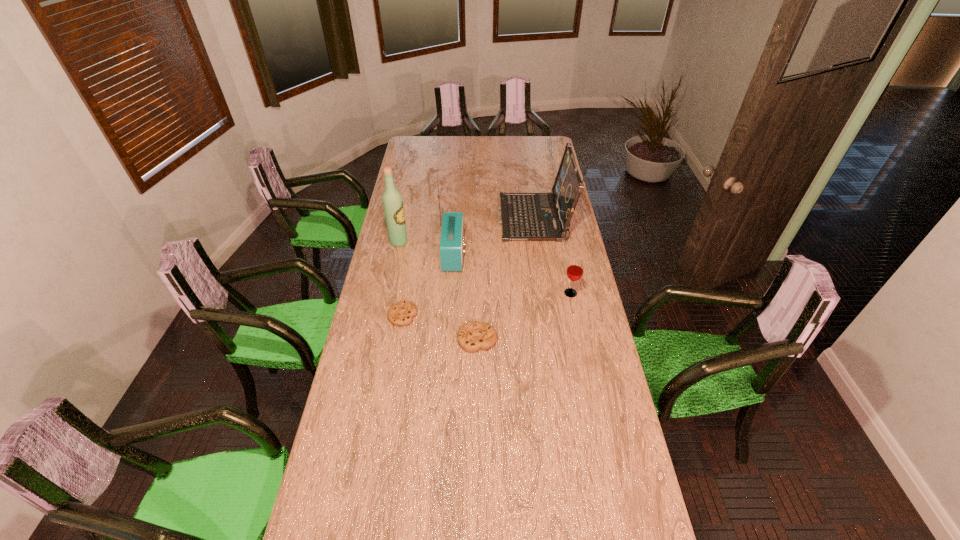
Please point a free position for a cookie on the right. Please provide its 2D coordinates. Your answer should be formatted as a tuple, i.e. [(x, y)], where the tuple contains the x and y coordinates of a point satisfying the conditions above.

[(560, 364)]